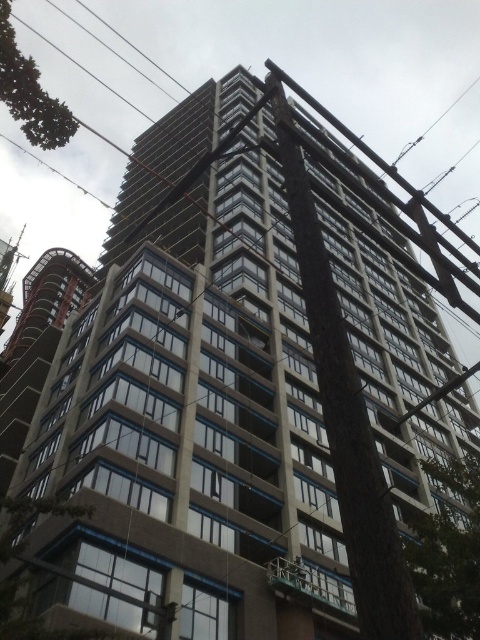
Question: Can you confirm if concrete at center is thinner than green leafy tree at upper left?

Choices:
 (A) no
 (B) yes

Answer: (B)

Question: Which point is closer to the camera taking this photo?

Choices:
 (A) (354, 564)
 (B) (57, 131)

Answer: (A)

Question: Which of the following is the farthest from the observer?

Choices:
 (A) black wire at upper left
 (B) concrete at center
 (C) green leafy tree at lower right
 (D) green leafy tree at upper left

Answer: (A)

Question: Does concrete at center appear under green leafy tree at upper left?

Choices:
 (A) no
 (B) yes

Answer: (B)

Question: Which object is the farthest from the green leafy tree at lower right?

Choices:
 (A) concrete at center
 (B) black wire at upper left
 (C) green leafy tree at upper left

Answer: (B)

Question: Does green leafy tree at lower right appear on the left side of black wire at upper left?

Choices:
 (A) yes
 (B) no

Answer: (B)